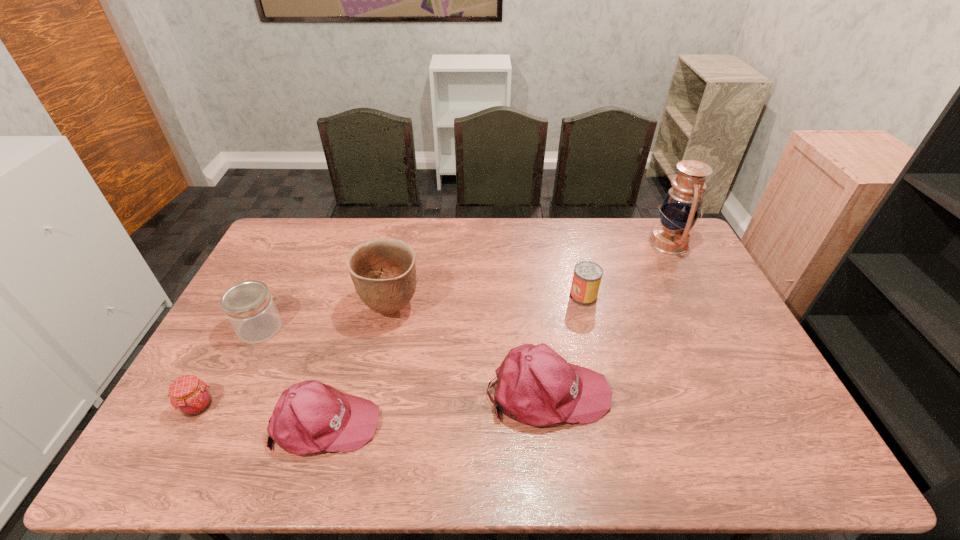
Where is `free space located on the back of the rightmost object`? This screenshot has width=960, height=540. free space located on the back of the rightmost object is located at coordinates pos(657,219).

Identify the location of free region located 0.330m on the back of the can. (566, 229).

Where is `vacant space located on the front of the jar`? Image resolution: width=960 pixels, height=540 pixels. vacant space located on the front of the jar is located at coordinates (245, 359).

The image size is (960, 540). What are the coordinates of `vacant space located 0.120m on the left of the pottery` in the screenshot? It's located at (323, 308).

This screenshot has width=960, height=540. I want to click on blank area located on the back of the jam, so click(x=225, y=356).

The image size is (960, 540). I want to click on object at the far edge, so click(x=681, y=207).

Identify the location of jam that is at the near edge. The width and height of the screenshot is (960, 540). (189, 395).

The image size is (960, 540). Identify the location of jar that is positioned at the left edge. (249, 307).

This screenshot has width=960, height=540. What are the coordinates of `jam present at the left edge` in the screenshot? It's located at (189, 395).

The image size is (960, 540). Identify the location of object present at the right edge. (681, 207).